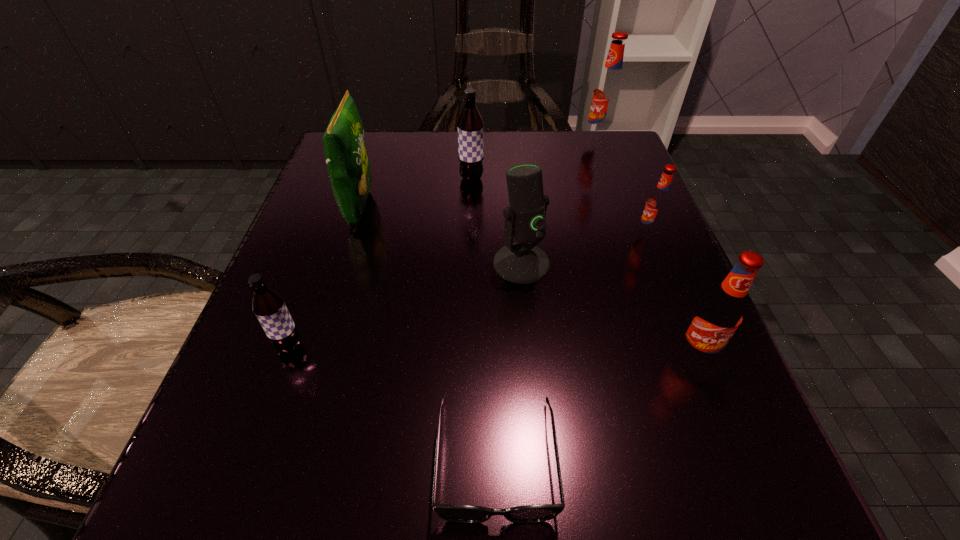
Identify the location of the farthest root beer. The image size is (960, 540). (608, 92).

This screenshot has height=540, width=960. Identify the location of the tallest root beer. (608, 92).

This screenshot has height=540, width=960. Find the location of `green crisp (potato chip)`. green crisp (potato chip) is located at coordinates (348, 165).

Image resolution: width=960 pixels, height=540 pixels. In order to click on the right brown root beer in this screenshot , I will do `click(470, 124)`.

Find the location of a particular element. the fourth nearest root beer is located at coordinates (470, 124).

Where is `the second smallest red root beer`? the second smallest red root beer is located at coordinates (x=719, y=314).

The height and width of the screenshot is (540, 960). Identify the location of the fifth farthest object. (523, 263).

Where is `the smallest red root beer`? This screenshot has height=540, width=960. the smallest red root beer is located at coordinates (658, 203).

Image resolution: width=960 pixels, height=540 pixels. I want to click on the second farthest red root beer, so click(658, 203).

At what (x,y) coordinates should I click in order to perform the action: click on the smaller brown root beer. Please return your answer as a coordinate pair (x, y). Looking at the image, I should click on (269, 307).